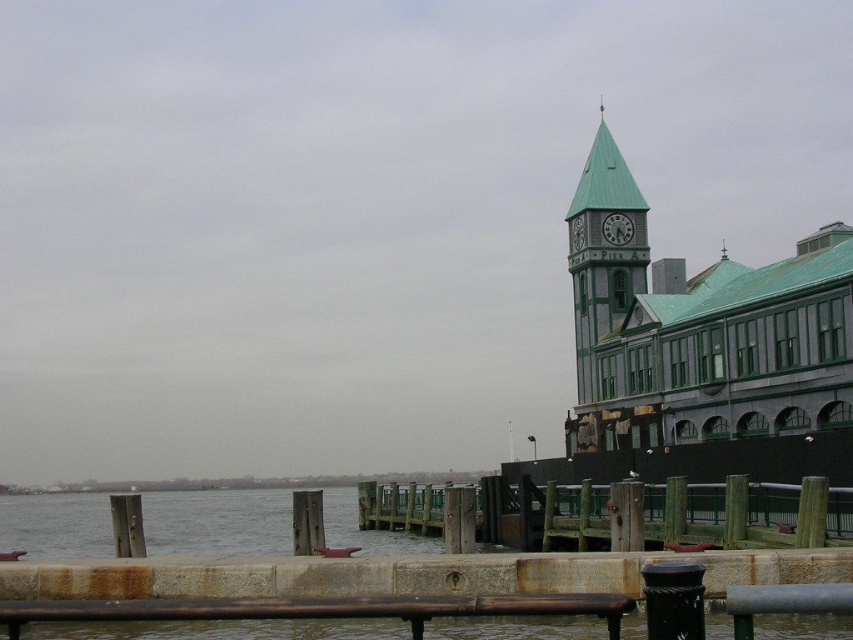
You are standing at the point marked as point (618, 228) in the waterfront scene. What object are you currently located on?

You are located on the green metallic clock at upper center, as the point (618, 228) is specified to be on that object.

You are a photographer planning to capture the waterfront scene. You want to ensure that the clear water at lower left and the green wooden clock tower at upper right are both visible in your shot. Based on their sizes in the image, which object will occupy more of the frame horizontally?

The clear water at lower left occupies more of the frame horizontally than the green wooden clock tower at upper right because its width is larger.